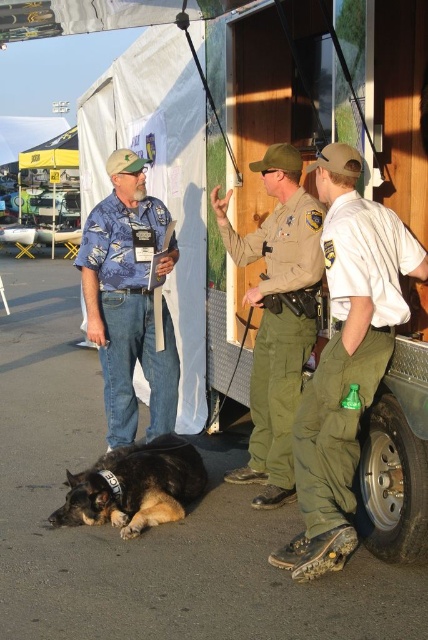
You are a photographer at the event. You want to take a photo that includes both the blue floral shirt at center and the metallic silver tire at lower right. Which object should you focus on first if you want to ensure both are in frame?

The blue floral shirt at center is larger than the metallic silver tire at lower right, so you should focus on the blue floral shirt at center first to ensure both are in frame.

From the picture: You are standing at the same position as the photographer. Which of the two points, point [128,292] or point [238,260], is closer to you?

Point [128,292] is closer to you because it is further to the camera than point [238,260].